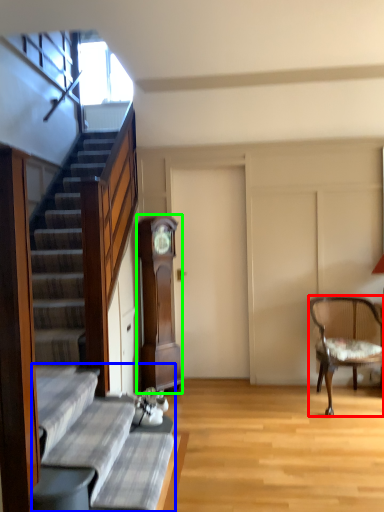
Question: Which object is the farthest from chair (highlighted by a red box)? Choose among these: couch (highlighted by a blue box) or cabinetry (highlighted by a green box).

Choices:
 (A) couch
 (B) cabinetry

Answer: (A)